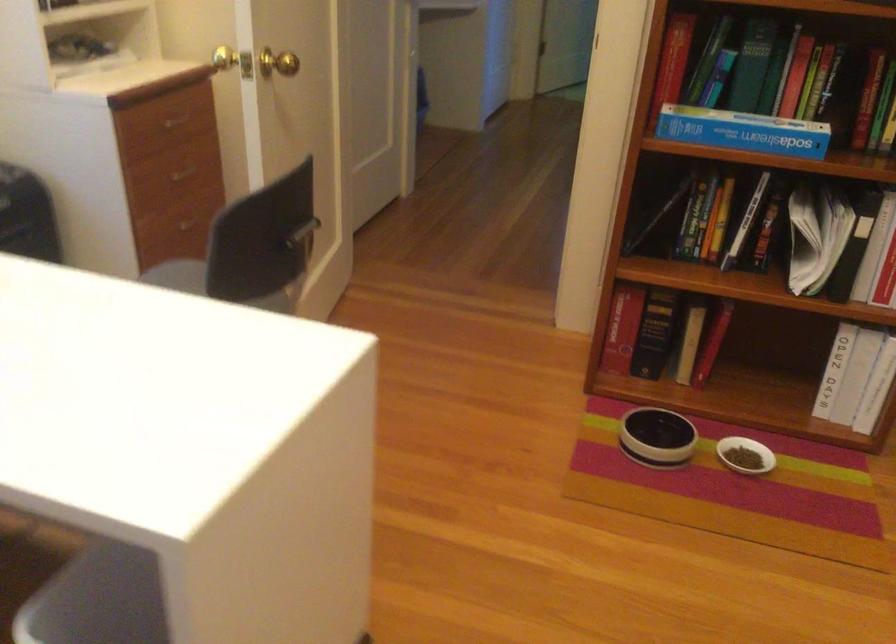
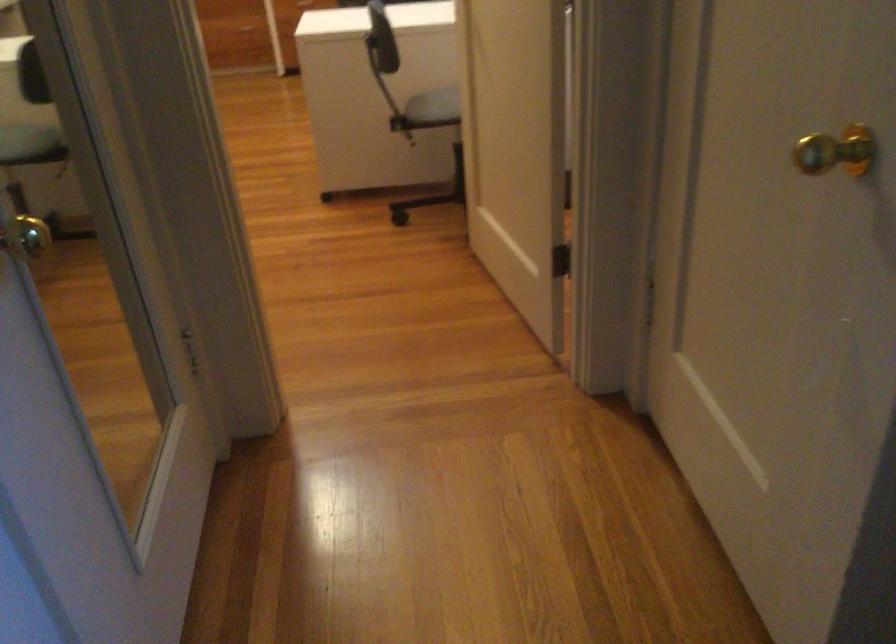
Question: I am providing you with two images of the same scene from different viewpoints. Please identify which objects are invisible in image2.

Choices:
 (A) gold door knob
 (B) black chair armrest
 (C) small white bowl
 (D) yellow spray bottle nozzle

Answer: (C)